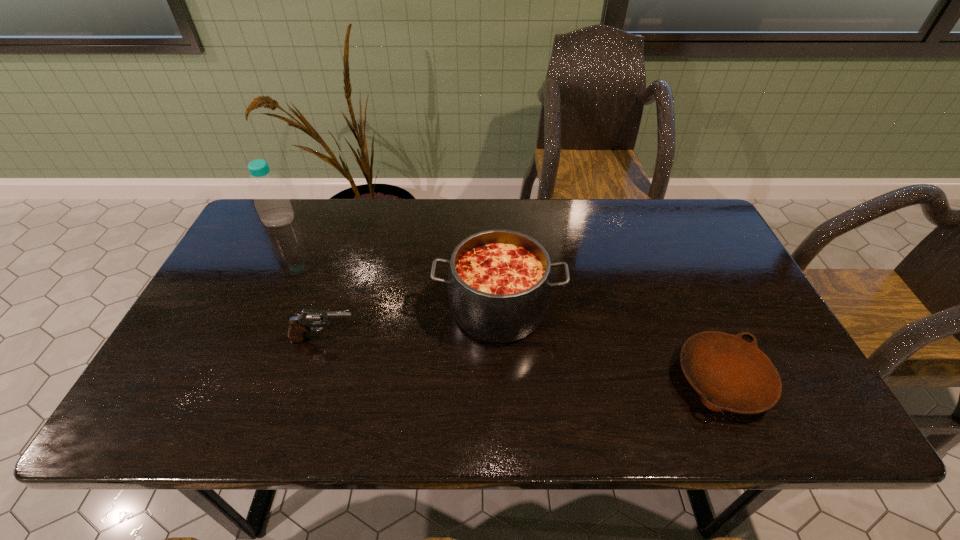
This screenshot has width=960, height=540. What are the coordinates of `free spot located on the back of the shortest object` in the screenshot? It's located at (670, 263).

What are the coordinates of `object present at the far edge` in the screenshot? It's located at (272, 203).

Find the location of `object present at the near edge`. object present at the near edge is located at coordinates (730, 374).

This screenshot has width=960, height=540. In order to click on object that is at the left edge in this screenshot , I will do pyautogui.click(x=272, y=203).

You are a GUI agent. You are given a task and a screenshot of the screen. Output one action in this format:
    pyautogui.click(x=<x>, y=<y>)
    Task: Click on the object located at the right edge
    
    Given the screenshot: What is the action you would take?
    click(730, 374)

What are the coordinates of `object that is at the far left corner` in the screenshot? It's located at (272, 203).

Where is `object that is positioned at the near right corner`? The width and height of the screenshot is (960, 540). object that is positioned at the near right corner is located at coordinates (730, 374).

You are a GUI agent. You are given a task and a screenshot of the screen. Output one action in this format:
    pyautogui.click(x=<x>, y=<y>)
    Task: Click on the blank space at the far edge
    This screenshot has height=540, width=960.
    Given the screenshot: What is the action you would take?
    pyautogui.click(x=333, y=214)

The height and width of the screenshot is (540, 960). I want to click on free spot at the near edge of the desktop, so click(x=246, y=402).

At what (x,y) coordinates should I click in order to perform the action: click on vacant space at the left edge of the desktop. Please return your answer as a coordinate pair (x, y). This screenshot has width=960, height=540. Looking at the image, I should click on [x=168, y=390].